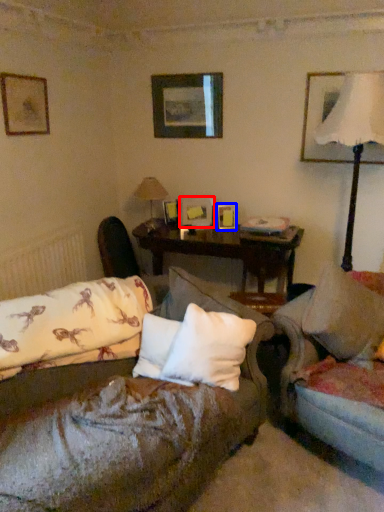
Question: Which of the following is the farthest to the observer, picture frame (highlighted by a red box) or picture frame (highlighted by a blue box)?

Choices:
 (A) picture frame
 (B) picture frame

Answer: (A)